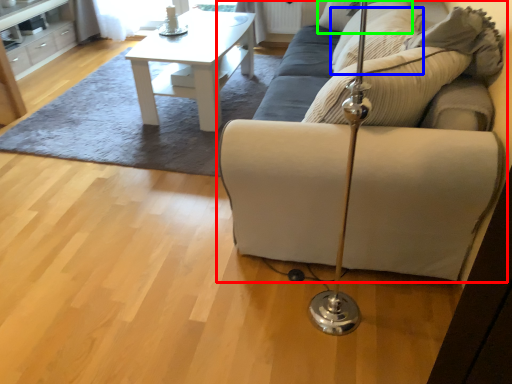
Question: Which is farther away from studio couch (highlighted by a red box)? pillow (highlighted by a blue box) or pillow (highlighted by a green box)?

Choices:
 (A) pillow
 (B) pillow

Answer: (B)